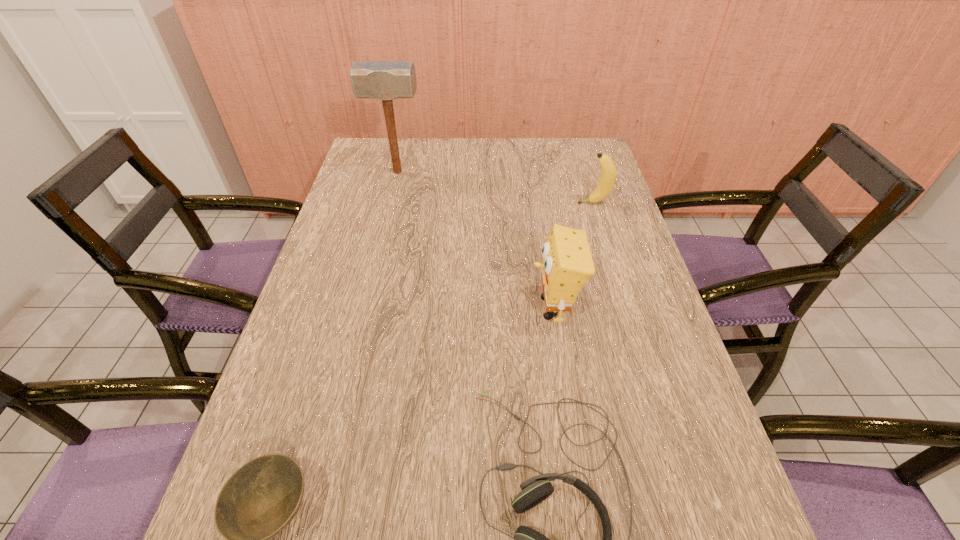
In order to click on free space between the banana and the mallet in this screenshot , I will do `click(495, 187)`.

The image size is (960, 540). I want to click on unoccupied area between the banana and the farthest object, so click(495, 187).

At what (x,y) coordinates should I click in order to perform the action: click on empty space between the sponge and the farthest object. Please return your answer as a coordinate pair (x, y). Image resolution: width=960 pixels, height=540 pixels. Looking at the image, I should click on (475, 240).

The height and width of the screenshot is (540, 960). Find the location of `free area in between the mallet and the fourth shortest object`. free area in between the mallet and the fourth shortest object is located at coordinates (475, 240).

Identify the location of object that is the third nearest to the bowl. The height and width of the screenshot is (540, 960). (385, 80).

The height and width of the screenshot is (540, 960). I want to click on object that stands as the fourth closest to the mallet, so click(262, 497).